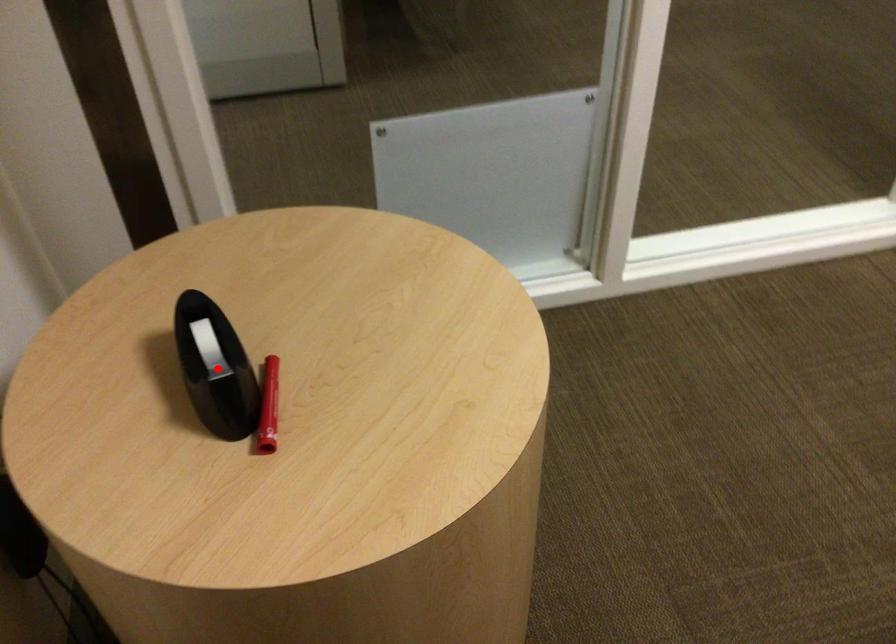
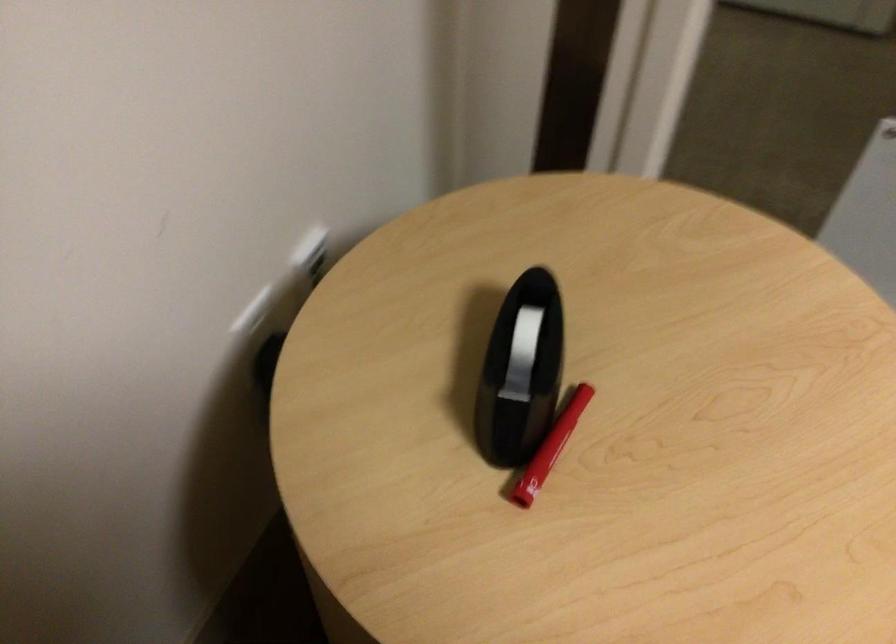
Question: I am providing you with two images of the same scene from different viewpoints. A red point is shown in image1. For the corresponding object point in image2, is it positioned nearer or farther from the camera?

Choices:
 (A) Nearer
 (B) Farther

Answer: (A)